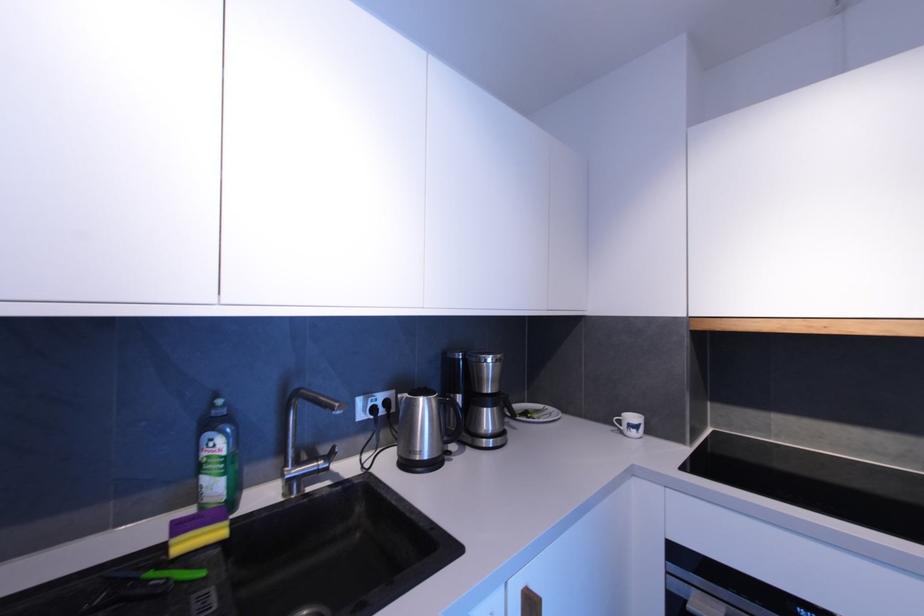
In order to click on mug handle in this screenshot , I will do [619, 422].